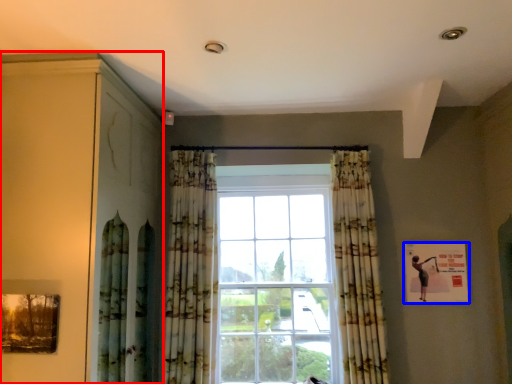
Question: Which of the following is the closest to the observer, dresser (highlighted by a red box) or picture frame (highlighted by a blue box)?

Choices:
 (A) dresser
 (B) picture frame

Answer: (A)